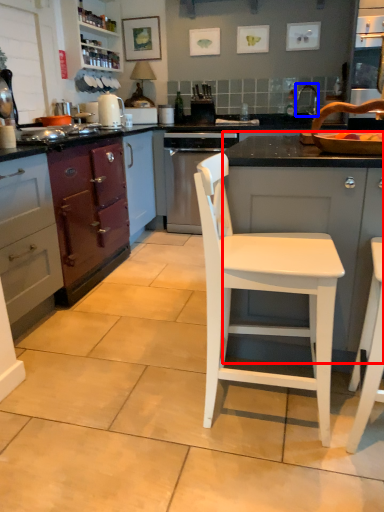
Question: Which object is closer to the camera taking this photo, cabinetry (highlighted by a red box) or faucet (highlighted by a blue box)?

Choices:
 (A) cabinetry
 (B) faucet

Answer: (A)